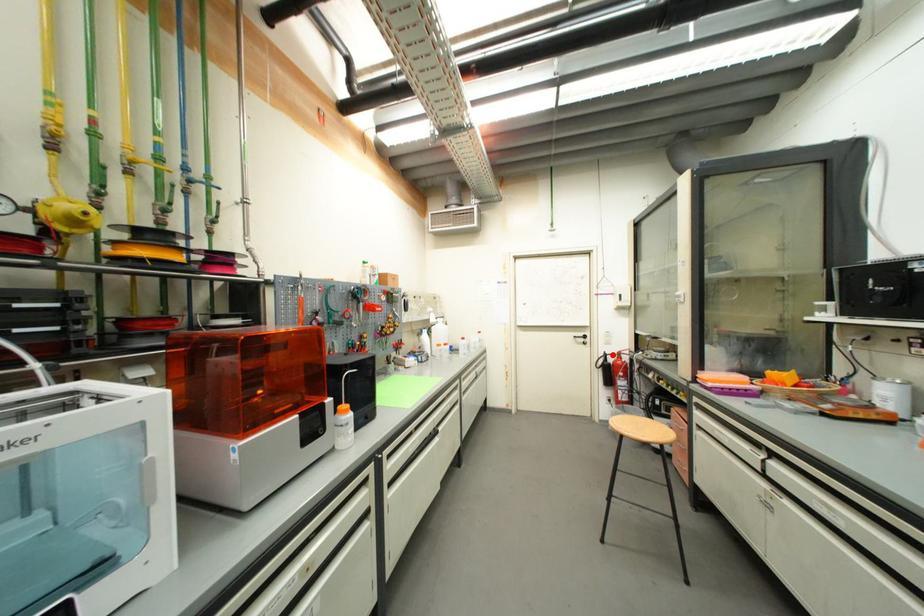
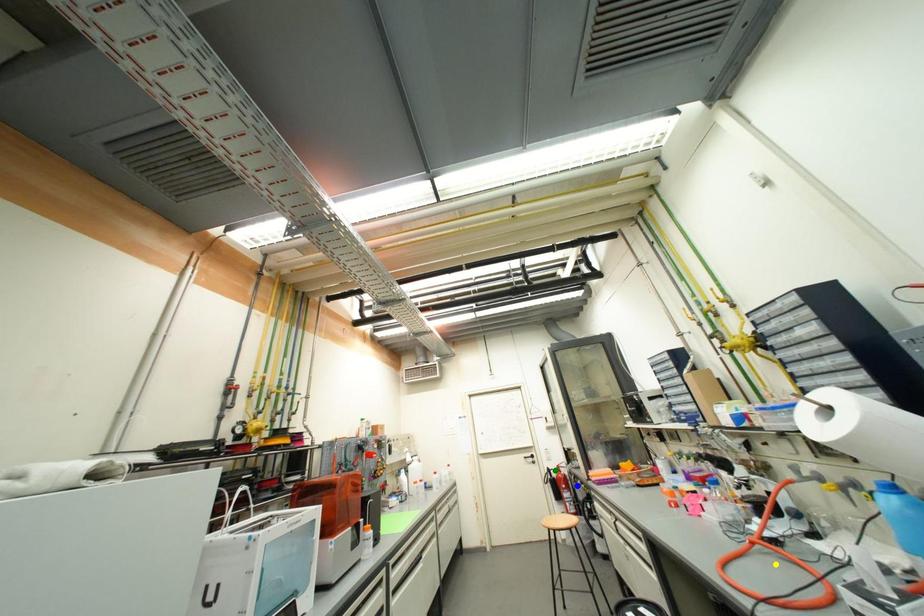
Question: I am providing you with two images of the same scene from different viewpoints. A red point is marked on the first image. You are given multiple points on the second image. Which spot in image 2 lines up with the point in image 1?

Choices:
 (A) yellow point
 (B) blue point
 (C) green point

Answer: (C)